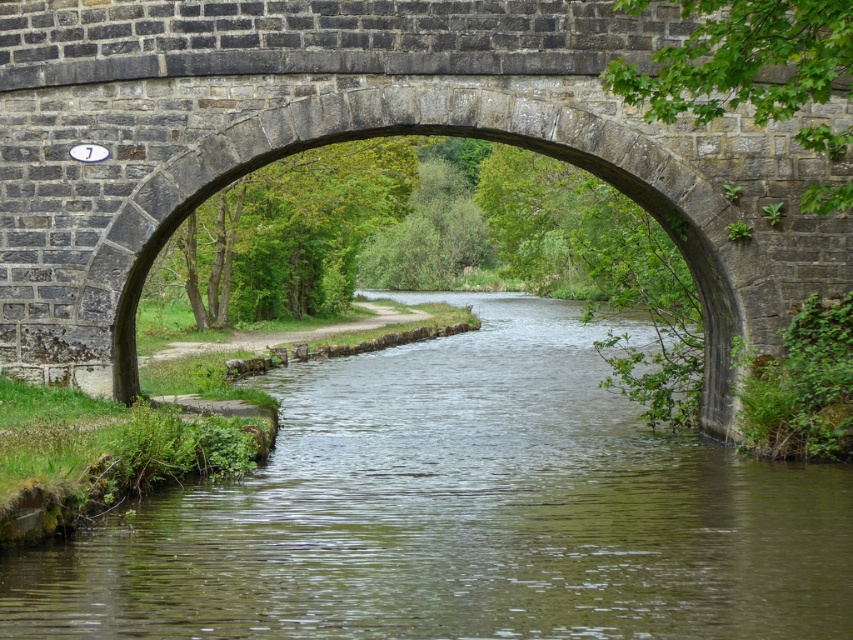
Question: Which object is closer to the camera taking this photo?

Choices:
 (A) stone arch bridge at center
 (B) green smooth water at center

Answer: (B)

Question: Among these points, which one is farthest from the camera?

Choices:
 (A) (802, 625)
 (B) (186, 170)

Answer: (B)

Question: Does green smooth water at center appear on the right side of stone arch bridge at center?

Choices:
 (A) no
 (B) yes

Answer: (A)

Question: Is green smooth water at center further to camera compared to stone arch bridge at center?

Choices:
 (A) no
 (B) yes

Answer: (A)

Question: Is green smooth water at center wider than stone arch bridge at center?

Choices:
 (A) yes
 (B) no

Answer: (A)